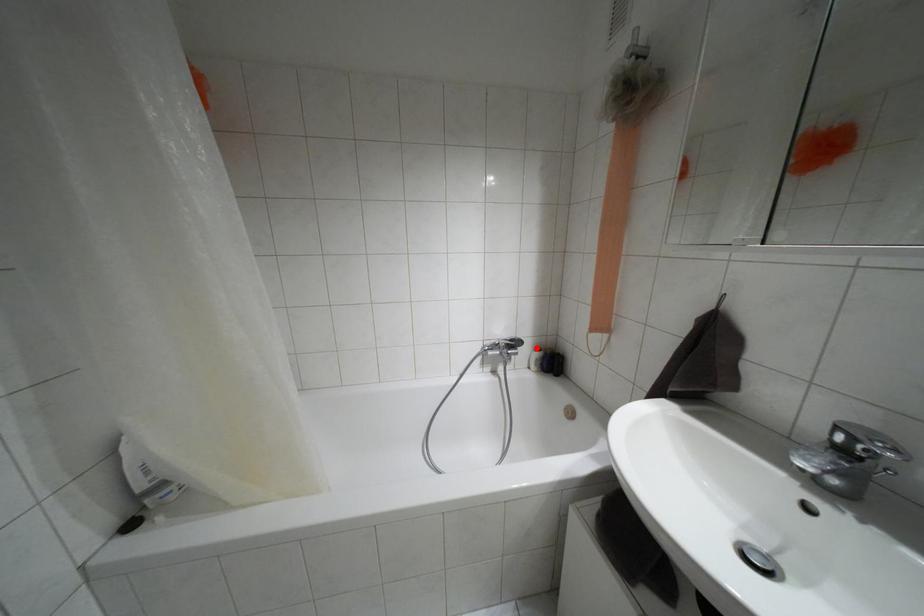
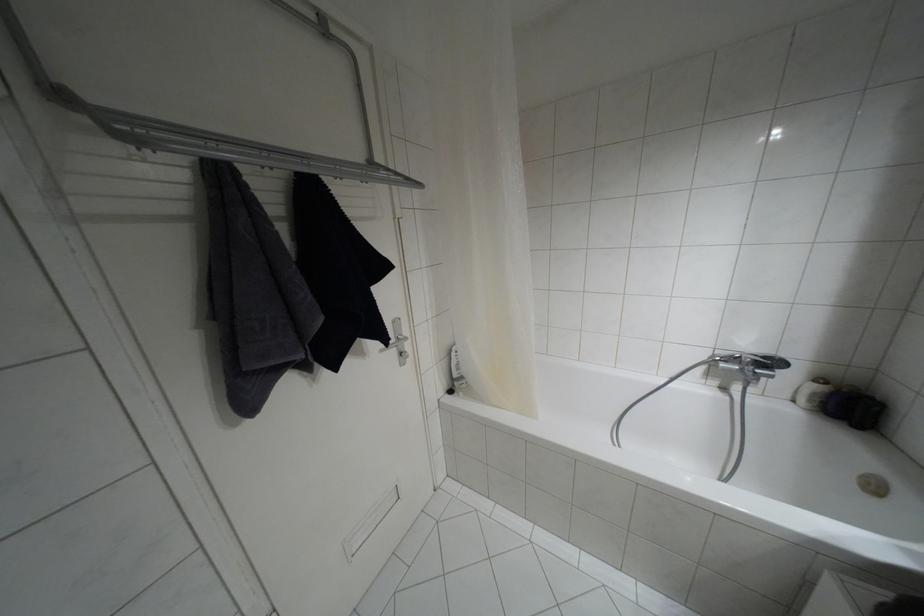
Where in the second image is the point corresponding to the highlighted location from the first image?

(820, 379)